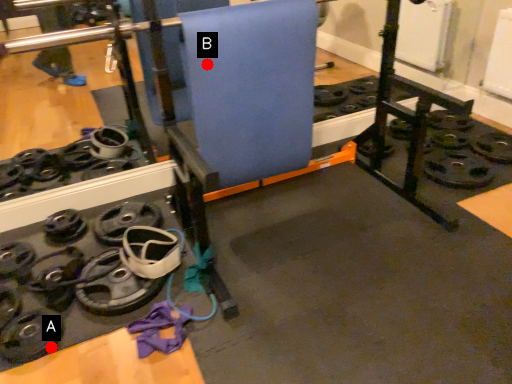
Question: Two points are circled on the image, labeled by A and B beside each circle. Among these points, which one is farthest from the camera?

Choices:
 (A) A is further
 (B) B is further

Answer: (B)